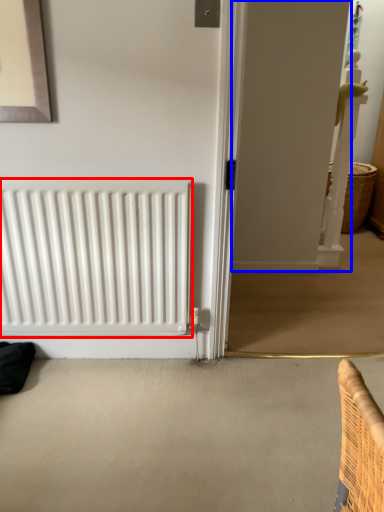
Question: Which point is further to the camera, radiator (highlighted by a red box) or screen door (highlighted by a blue box)?

Choices:
 (A) radiator
 (B) screen door

Answer: (A)